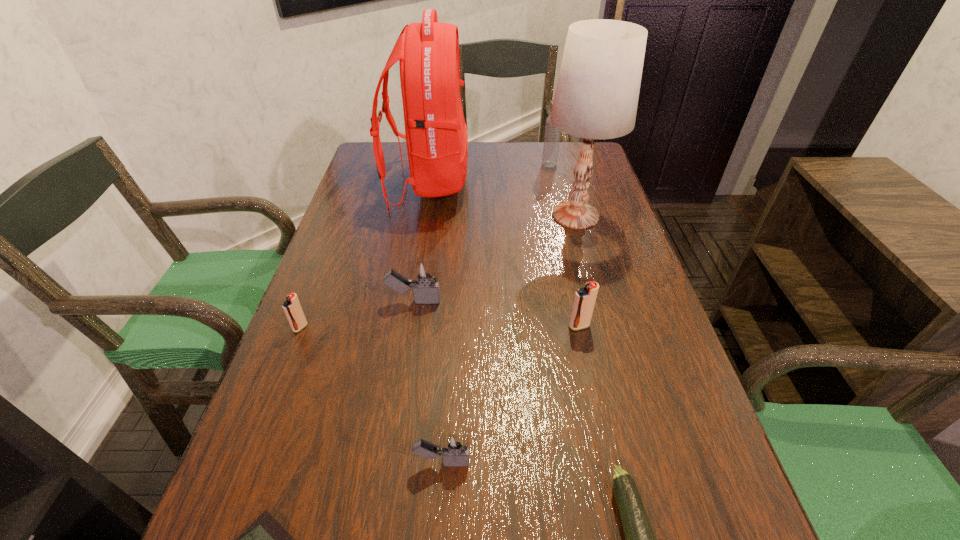
You are a GUI agent. You are given a task and a screenshot of the screen. Output one action in this format:
    pyautogui.click(x=<x>, y=<y>)
    Task: Click on the red backpack
    The image size is (960, 540).
    Given the screenshot: What is the action you would take?
    pyautogui.click(x=436, y=136)

Where is `lamp`? Image resolution: width=960 pixels, height=540 pixels. lamp is located at coordinates tap(597, 92).

Identify the location of water bottle. (552, 135).

At what (x,y) coordinates should I click in order to perform the action: click on the seventh shortest object. Please return your answer as a coordinate pair (x, y). The image size is (960, 540). Looking at the image, I should click on (552, 135).

Identify the location of the farthest igniter. (426, 291).

Image resolution: width=960 pixels, height=540 pixels. Identify the location of the bigger gray igniter. (426, 291).

The width and height of the screenshot is (960, 540). I want to click on the bigger red igniter, so click(584, 301).

Identify the location of the rightmost igniter. The height and width of the screenshot is (540, 960). (584, 301).

In order to click on the left red igniter in this screenshot , I will do `click(292, 308)`.

This screenshot has width=960, height=540. I want to click on the smaller red igniter, so click(x=292, y=308).